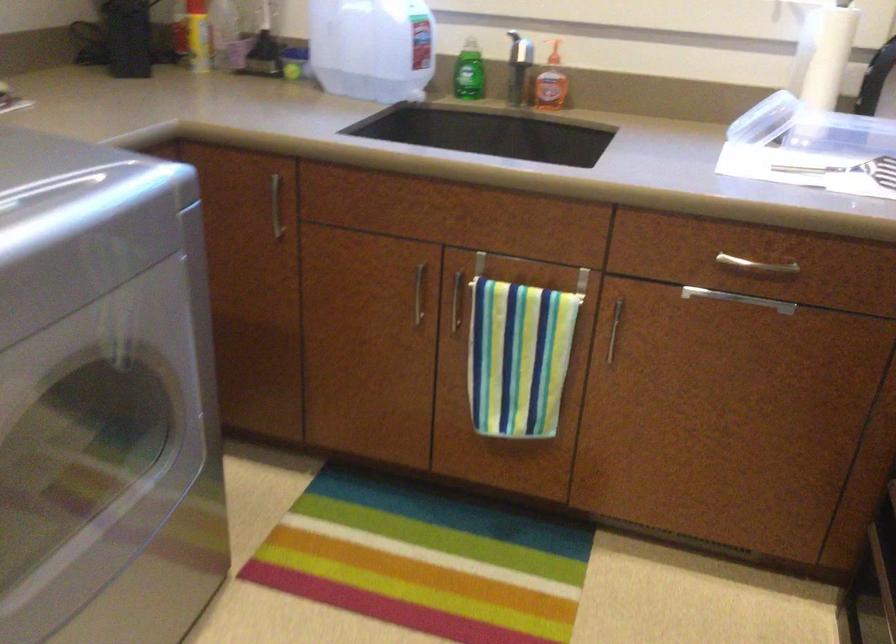
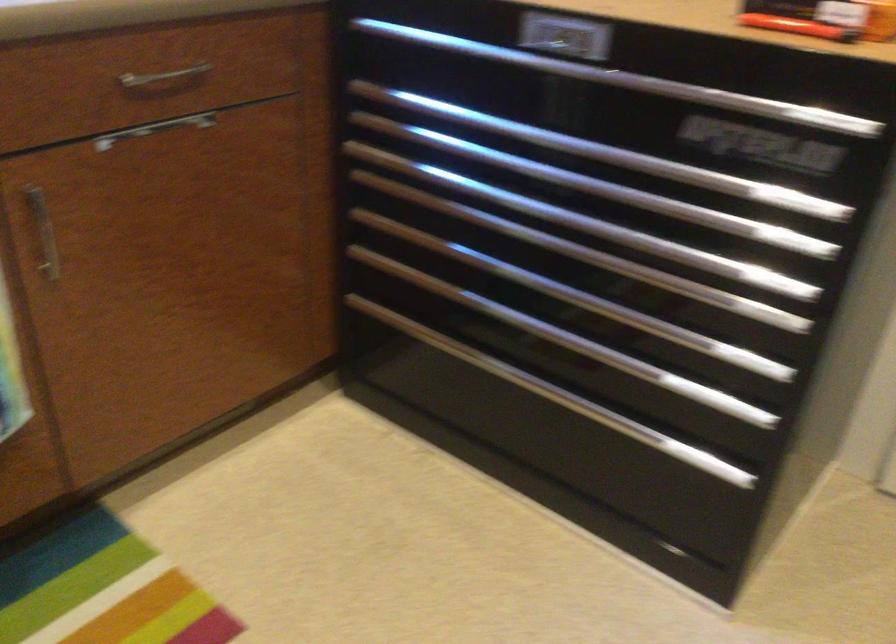
The point at (760, 263) is marked in the first image. Where is the corresponding point in the second image?

(164, 78)